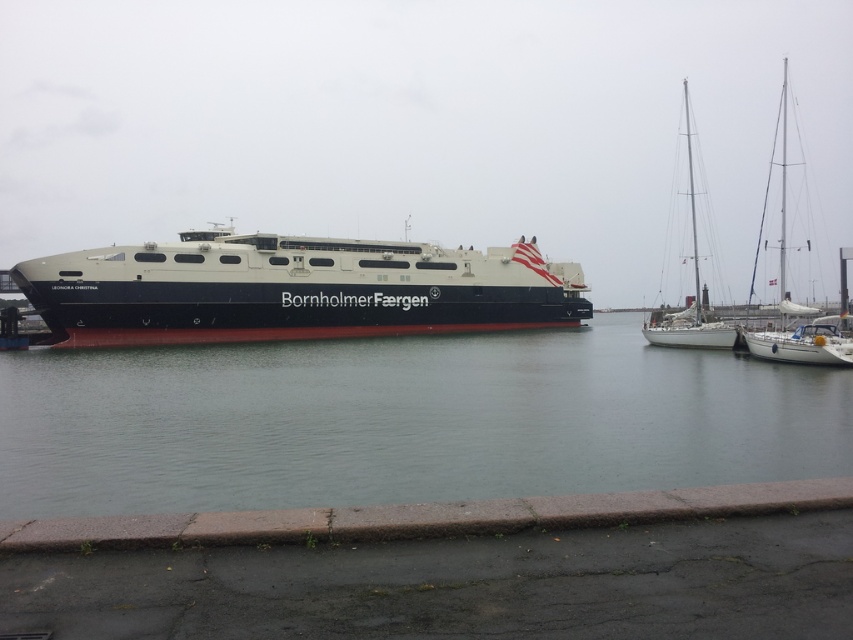
You are standing on the dock and looking at the ferry. There are two points marked on the ferry. One is at coordinate point (x=782, y=204) and the other is at point (x=732, y=332). Which point is closer to you?

Point (x=782, y=204) is closer to you because it is further to the viewer than point (x=732, y=332).

Consider the image. You are standing on the deck of the BornholmerFae rgen ferry and want to locate the white glossy sailboat at right. According to the coordinates provided, where should you look relative to your position?

The white glossy sailboat at right is located at coordinates point (792,301), which means it is positioned to the right and slightly forward of your current position on the ferry deck.

You are a harbor inspector checking vessel sizes for docking. You see the dark gray matte ferry at center and the white glossy sailboat at right. Which vessel requires a larger docking space based on their sizes?

The white glossy sailboat at right requires a larger docking space because it is bigger than the dark gray matte ferry at center.